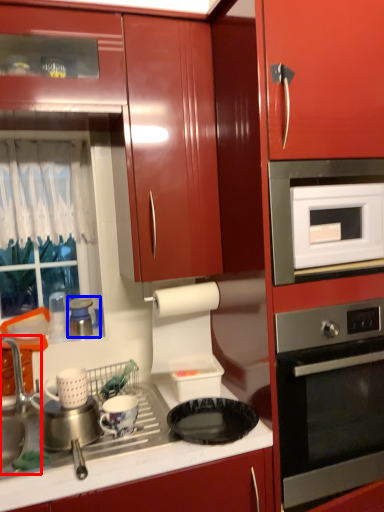
Question: Which of the following is the farthest to the observer, sink (highlighted by a red box) or appliance (highlighted by a blue box)?

Choices:
 (A) sink
 (B) appliance

Answer: (B)